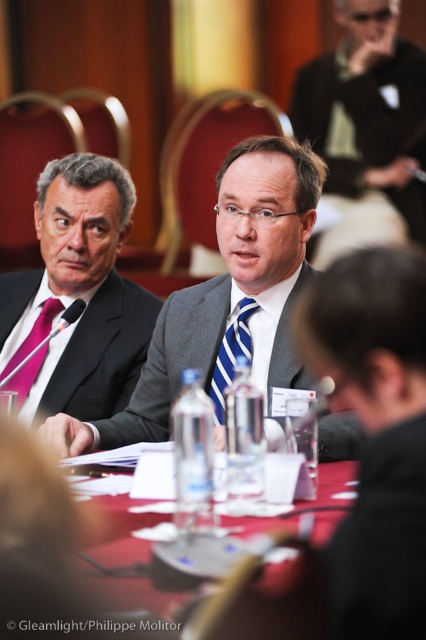
Which is below, pink silk tie at left or blue striped tie at center?

blue striped tie at center is lower down.

Can you confirm if pink silk tie at left is smaller than blue striped tie at center?

Incorrect, pink silk tie at left is not smaller in size than blue striped tie at center.

You are a GUI agent. You are given a task and a screenshot of the screen. Output one action in this format:
    pyautogui.click(x=<x>, y=<y>)
    Task: Click on the pink silk tie at left
    
    Given the screenshot: What is the action you would take?
    pyautogui.click(x=77, y=296)

At what (x,y) coordinates should I click in order to perform the action: click on pink silk tie at left. Please return your answer as a coordinate pair (x, y). Image resolution: width=426 pixels, height=640 pixels. Looking at the image, I should click on (77, 296).

Who is positioned more to the right, matte black suit at center or pink satin tie at left?

matte black suit at center is more to the right.

Can you confirm if matte black suit at center is bigger than pink satin tie at left?

Yes, matte black suit at center is bigger than pink satin tie at left.

Is point (408, 189) farther from viewer compared to point (5, 371)?

Yes, point (408, 189) is behind point (5, 371).

The width and height of the screenshot is (426, 640). Identify the location of matte black suit at center. (367, 108).

Is gray suit at center below smooth plastic water bottle at center?

Incorrect, gray suit at center is not positioned below smooth plastic water bottle at center.

Is point (256, 291) closer to viewer compared to point (120, 486)?

No, it is behind (120, 486).

What do you see at coordinates (226, 298) in the screenshot? The image size is (426, 640). I see `gray suit at center` at bounding box center [226, 298].

Where is `gray suit at center`? gray suit at center is located at coordinates (226, 298).